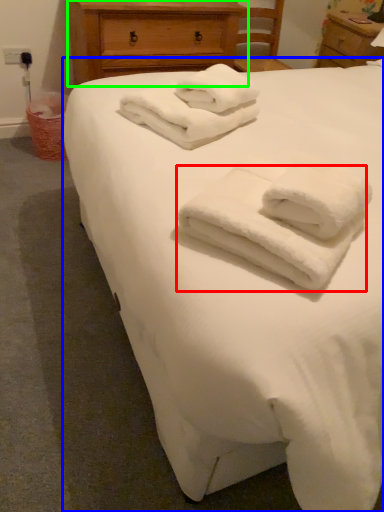
Question: Which is nearer to the towel (highlighted by a red box)? bed (highlighted by a blue box) or chest of drawers (highlighted by a green box).

Choices:
 (A) bed
 (B) chest of drawers

Answer: (A)